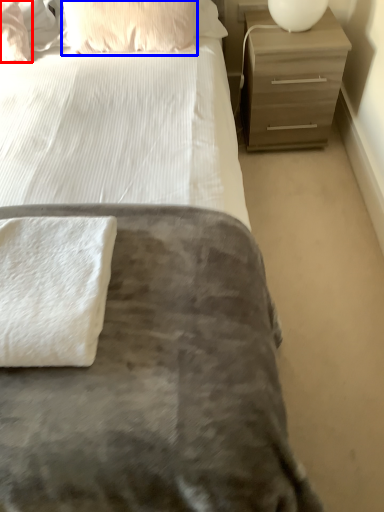
Question: Which object is further to the camera taking this photo, pillow (highlighted by a red box) or pillow (highlighted by a blue box)?

Choices:
 (A) pillow
 (B) pillow

Answer: (A)